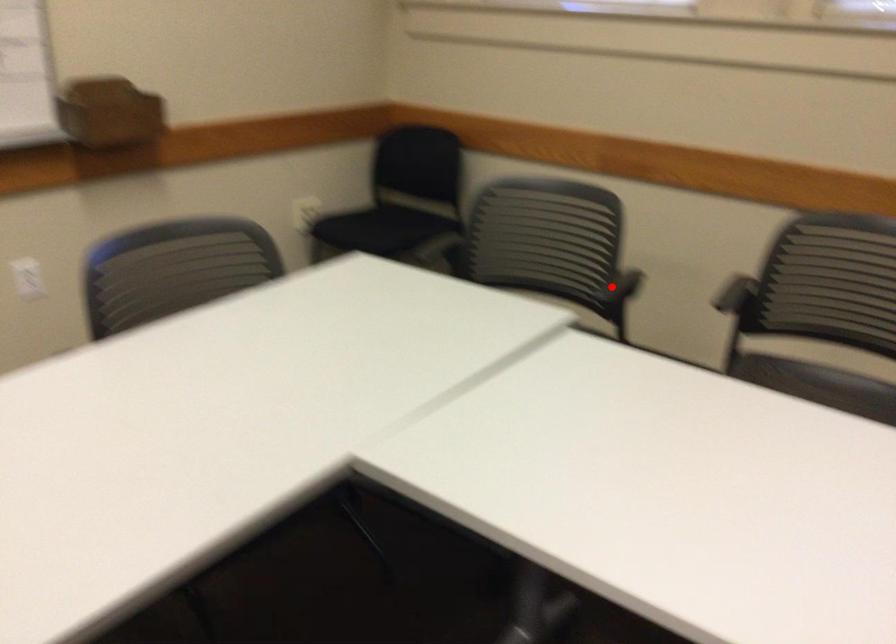
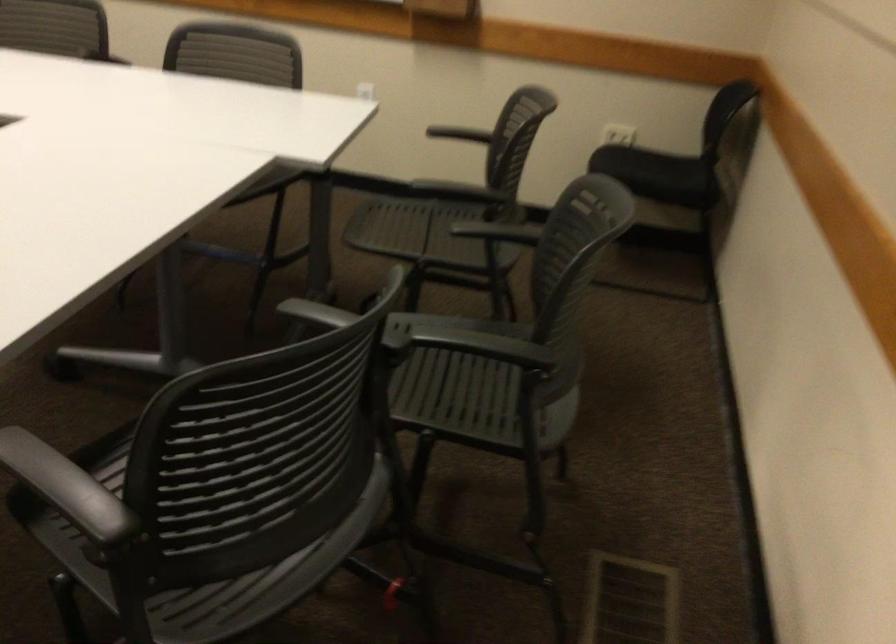
Where in the second image is the point corresponding to the highlighted location from the first image?

(461, 190)